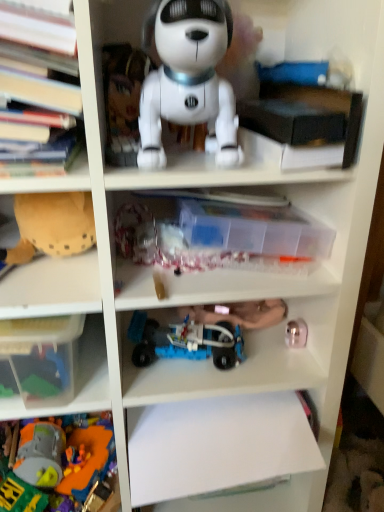
Based on the photo, measure the distance between point (188, 207) and camera.

Point (188, 207) is 71.50 centimeters from camera.

This screenshot has height=512, width=384. What do you see at coordinates (296, 333) in the screenshot?
I see `metallic gold toy at lower right, positioned as the 3th toy in top-to-bottom order` at bounding box center [296, 333].

The width and height of the screenshot is (384, 512). What do you see at coordinates (42, 357) in the screenshot?
I see `translucent plastic storage box at lower left` at bounding box center [42, 357].

Locate an element on the screen. The width and height of the screenshot is (384, 512). blue plastic toy car at center, the 2th toy in the bottom-to-top sequence is located at coordinates (185, 341).

Can you confirm if white matte robot dog at upper center, the first toy viewed from the top, is wider than plastic orange and gray toy at lower left, arranged as the 1th toy when ordered from the bottom?

No, white matte robot dog at upper center, the first toy viewed from the top, is not wider than plastic orange and gray toy at lower left, arranged as the 1th toy when ordered from the bottom.

In the image, is white matte robot dog at upper center, arranged as the 5th toy when ordered from the bottom, positioned in front of or behind plastic orange and gray toy at lower left, arranged as the 1th toy when ordered from the bottom?

Visually, white matte robot dog at upper center, arranged as the 5th toy when ordered from the bottom, is located in front of plastic orange and gray toy at lower left, arranged as the 1th toy when ordered from the bottom.

Are white matte robot dog at upper center, arranged as the 5th toy when ordered from the bottom, and plastic orange and gray toy at lower left, the 5th toy positioned from the top, beside each other?

No, white matte robot dog at upper center, arranged as the 5th toy when ordered from the bottom, is not next to plastic orange and gray toy at lower left, the 5th toy positioned from the top.

Does white matte robot dog at upper center, the first toy viewed from the top, turn towards plastic orange and gray toy at lower left, arranged as the 1th toy when ordered from the bottom?

No.

Can you confirm if transparent plastic container at center, which ranks as the second book in right-to-left order, is shorter than translucent plastic storage box at lower left?

Indeed, transparent plastic container at center, which ranks as the second book in right-to-left order, has a lesser height compared to translucent plastic storage box at lower left.

How different are the orientations of transparent plastic container at center, arranged as the second book when viewed from the left, and translucent plastic storage box at lower left in degrees?

There is a 0.14-degree angle between the facing directions of transparent plastic container at center, arranged as the second book when viewed from the left, and translucent plastic storage box at lower left.

Does transparent plastic container at center, which ranks as the second book in right-to-left order, turn towards translucent plastic storage box at lower left?

No, transparent plastic container at center, which ranks as the second book in right-to-left order, does not turn towards translucent plastic storage box at lower left.

Is there a large distance between transparent plastic container at center, arranged as the second book when viewed from the left, and translucent plastic storage box at lower left?

transparent plastic container at center, arranged as the second book when viewed from the left, is actually quite close to translucent plastic storage box at lower left.

From a real-world perspective, is hardcover books at left, the 3th book when ordered from right to left, above or below white matte robot dog at upper center, the first toy viewed from the top?

Clearly, from a real-world perspective, hardcover books at left, the 3th book when ordered from right to left, is above white matte robot dog at upper center, the first toy viewed from the top.

Is hardcover books at left, which is counted as the 1th book, starting from the left, oriented away from white matte robot dog at upper center, arranged as the 5th toy when ordered from the bottom?

hardcover books at left, which is counted as the 1th book, starting from the left, does not have its back to white matte robot dog at upper center, arranged as the 5th toy when ordered from the bottom.

Considering the points (6, 22) and (194, 113), which point is in front, point (6, 22) or point (194, 113)?

The point (6, 22) is more forward.

From a real-world perspective, is blue plastic toy car at center, the 2th toy in the bottom-to-top sequence, located beneath brown fabric toy at left, the second toy viewed from the top?

Yes, from a real-world perspective, blue plastic toy car at center, the 2th toy in the bottom-to-top sequence, is under brown fabric toy at left, the second toy viewed from the top.

Between blue plastic toy car at center, the fourth toy positioned from the top, and brown fabric toy at left, the second toy viewed from the top, which one has smaller width?

blue plastic toy car at center, the fourth toy positioned from the top.

Can brown fabric toy at left, the second toy viewed from the top, be found inside blue plastic toy car at center, the 2th toy in the bottom-to-top sequence?

No, blue plastic toy car at center, the 2th toy in the bottom-to-top sequence, does not contain brown fabric toy at left, the second toy viewed from the top.

Consider the image. Is white plastic drawer at center beside hardcover books at left, which is counted as the 1th book, starting from the left?

They are not placed beside each other.

Is white plastic drawer at center facing towards hardcover books at left, the 3th book when ordered from right to left?

No, white plastic drawer at center is not turned towards hardcover books at left, the 3th book when ordered from right to left.

From the picture: What's the angular difference between white plastic drawer at center and hardcover books at left, the 3th book when ordered from right to left,'s facing directions?

The angle between the facing direction of white plastic drawer at center and the facing direction of hardcover books at left, the 3th book when ordered from right to left, is 0.0599 degrees.

Choose the correct answer: Is white plastic drawer at center inside hardcover books at left, the 3th book when ordered from right to left, or outside it?

white plastic drawer at center is not enclosed by hardcover books at left, the 3th book when ordered from right to left.

Is transparent plastic container at center, which ranks as the second book in right-to-left order, taller or shorter than plastic orange and gray toy at lower left, arranged as the 1th toy when ordered from the bottom?

In the image, transparent plastic container at center, which ranks as the second book in right-to-left order, appears to be shorter than plastic orange and gray toy at lower left, arranged as the 1th toy when ordered from the bottom.

Which of these two, transparent plastic container at center, which ranks as the second book in right-to-left order, or plastic orange and gray toy at lower left, the 5th toy positioned from the top, is smaller?

With smaller size is transparent plastic container at center, which ranks as the second book in right-to-left order.

Is transparent plastic container at center, arranged as the second book when viewed from the left, far away from plastic orange and gray toy at lower left, the 5th toy positioned from the top?

They are positioned close to each other.

Does hardcover books at left, the 3th book when ordered from right to left, turn towards transparent plastic container at center, arranged as the second book when viewed from the left?

No.

From the image's perspective, is hardcover books at left, the 3th book when ordered from right to left, below transparent plastic container at center, which ranks as the second book in right-to-left order?

No, from the image's perspective, hardcover books at left, the 3th book when ordered from right to left, is not beneath transparent plastic container at center, which ranks as the second book in right-to-left order.

Who is taller, hardcover books at left, the 3th book when ordered from right to left, or transparent plastic container at center, arranged as the second book when viewed from the left?

Standing taller between the two is hardcover books at left, the 3th book when ordered from right to left.

Between hardcover books at left, which is counted as the 1th book, starting from the left, and transparent plastic container at center, arranged as the second book when viewed from the left, which one is positioned in front?

hardcover books at left, which is counted as the 1th book, starting from the left, is closer to the camera.

The image size is (384, 512). Identify the location of toy that is the 2nd object located in front of the plastic orange and gray toy at lower left, arranged as the 1th toy when ordered from the bottom. (189, 80).

At what (x,y) coordinates should I click in order to perform the action: click on the 1st book positioned above the translucent plastic storage box at lower left (from a real-world perspective). Please return your answer as a coordinate pair (x, y). Looking at the image, I should click on (221, 236).

In the scene shown: Estimate the real-world distances between objects in this image. Which object is further from hardcover books at left, which is counted as the 1th book, starting from the left, plastic orange and gray toy at lower left, the 5th toy positioned from the top, or blue plastic toy car at center, the 2th toy in the bottom-to-top sequence?

plastic orange and gray toy at lower left, the 5th toy positioned from the top, lies further to hardcover books at left, which is counted as the 1th book, starting from the left, than the other object.

Based on their spatial positions, is plastic orange and gray toy at lower left, arranged as the 1th toy when ordered from the bottom, or white matte robot dog at upper center, arranged as the 5th toy when ordered from the bottom, closer to white plastic drawer at center?

Among the two, plastic orange and gray toy at lower left, arranged as the 1th toy when ordered from the bottom, is located nearer to white plastic drawer at center.

Estimate the real-world distances between objects in this image. Which object is further from metallic gold toy at lower right, marked as the third toy in a bottom-to-top arrangement, blue plastic toy car at center, the fourth toy positioned from the top, or transparent plastic container at center, which ranks as the second book in right-to-left order?

transparent plastic container at center, which ranks as the second book in right-to-left order.

Estimate the real-world distances between objects in this image. Which object is further from plastic orange and gray toy at lower left, the 5th toy positioned from the top, white matte robot dog at upper center, arranged as the 5th toy when ordered from the bottom, or transparent plastic container at center, which ranks as the second book in right-to-left order?

white matte robot dog at upper center, arranged as the 5th toy when ordered from the bottom, lies further to plastic orange and gray toy at lower left, the 5th toy positioned from the top, than the other object.

From the picture: Looking at the image, which one is located closer to black matte book at upper right, marked as the 3th book in a left-to-right arrangement, blue plastic toy car at center, the 2th toy in the bottom-to-top sequence, or transparent plastic container at center, arranged as the second book when viewed from the left?

transparent plastic container at center, arranged as the second book when viewed from the left.

When comparing their distances from white plastic drawer at center, does transparent plastic container at center, arranged as the second book when viewed from the left, or hardcover books at left, which is counted as the 1th book, starting from the left, seem closer?

transparent plastic container at center, arranged as the second book when viewed from the left, lies closer to white plastic drawer at center than the other object.

Based on their spatial positions, is metallic gold toy at lower right, positioned as the 3th toy in top-to-bottom order, or blue plastic toy car at center, the fourth toy positioned from the top, further from black matte book at upper right, marked as the 3th book in a left-to-right arrangement?

Based on the image, metallic gold toy at lower right, positioned as the 3th toy in top-to-bottom order, appears to be further to black matte book at upper right, marked as the 3th book in a left-to-right arrangement.

Which object lies further to the anchor point transparent plastic container at center, arranged as the second book when viewed from the left, translucent plastic storage box at lower left or plastic orange and gray toy at lower left, arranged as the 1th toy when ordered from the bottom?

plastic orange and gray toy at lower left, arranged as the 1th toy when ordered from the bottom, is positioned further to the anchor transparent plastic container at center, arranged as the second book when viewed from the left.

Find the location of a particular element. The width and height of the screenshot is (384, 512). storage box between black matte book at upper right, the first book when ordered from right to left, and plastic orange and gray toy at lower left, arranged as the 1th toy when ordered from the bottom, vertically is located at coordinates (42, 357).

Image resolution: width=384 pixels, height=512 pixels. I want to click on drawer situated between translucent plastic storage box at lower left and metallic gold toy at lower right, marked as the third toy in a bottom-to-top arrangement, from left to right, so [218, 446].

Locate an element on the screen. Image resolution: width=384 pixels, height=512 pixels. book between black matte book at upper right, marked as the 3th book in a left-to-right arrangement, and blue plastic toy car at center, the 2th toy in the bottom-to-top sequence, from top to bottom is located at coordinates (221, 236).

Locate an element on the screen. Image resolution: width=384 pixels, height=512 pixels. storage box between hardcover books at left, the 3th book when ordered from right to left, and white plastic drawer at center vertically is located at coordinates (42, 357).